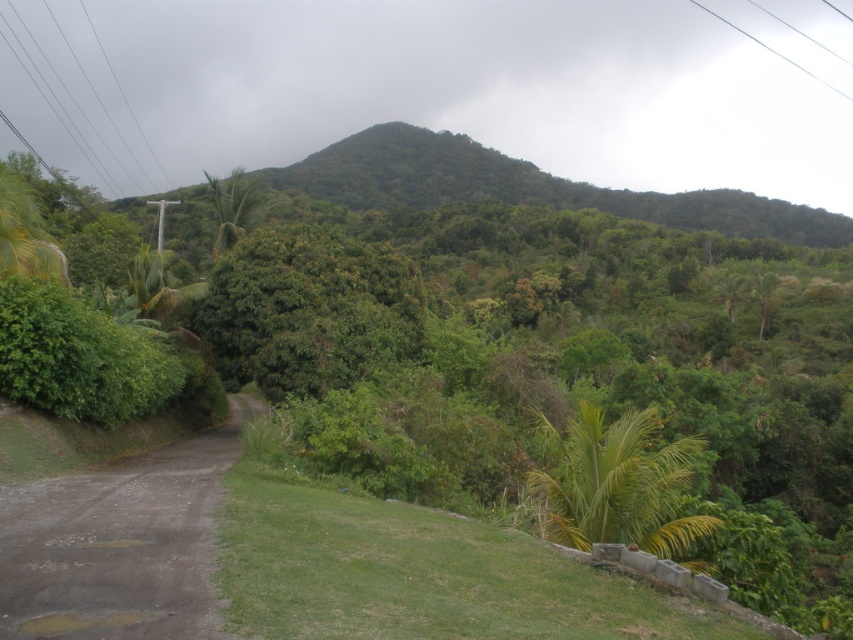
Does metallic wire at upper left have a larger size compared to green leafy palm at left?

No, metallic wire at upper left is not bigger than green leafy palm at left.

Between metallic wire at upper left and green leafy palm at left, which one appears on the left side from the viewer's perspective?

metallic wire at upper left

Is point (73, 48) positioned in front of point (250, 225)?

No, (73, 48) is further to viewer.

This screenshot has height=640, width=853. Find the location of `metallic wire at upper left`. metallic wire at upper left is located at coordinates (80, 97).

Looking at this image, is the position of green leafy palm at left less distant than that of white plastic power line at upper right?

Yes, green leafy palm at left is closer to the viewer.

Does point (230, 237) come in front of point (688, 1)?

Yes, it is.

At what (x,y) coordinates should I click in order to perform the action: click on green leafy palm at left. Please return your answer as a coordinate pair (x, y). This screenshot has width=853, height=640. Looking at the image, I should click on (234, 205).

Does green leafy mountain at center come in front of green leafy palm at center?

No, it is not.

Between green leafy mountain at center and green leafy palm at center, which one is positioned lower?

Positioned lower is green leafy palm at center.

Identify the location of green leafy mountain at center. Image resolution: width=853 pixels, height=640 pixels. (526, 188).